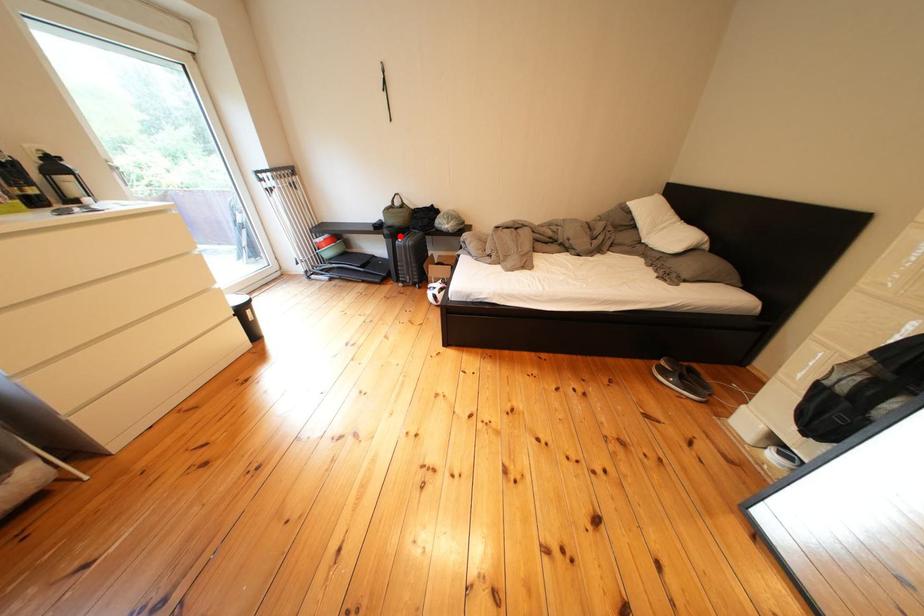
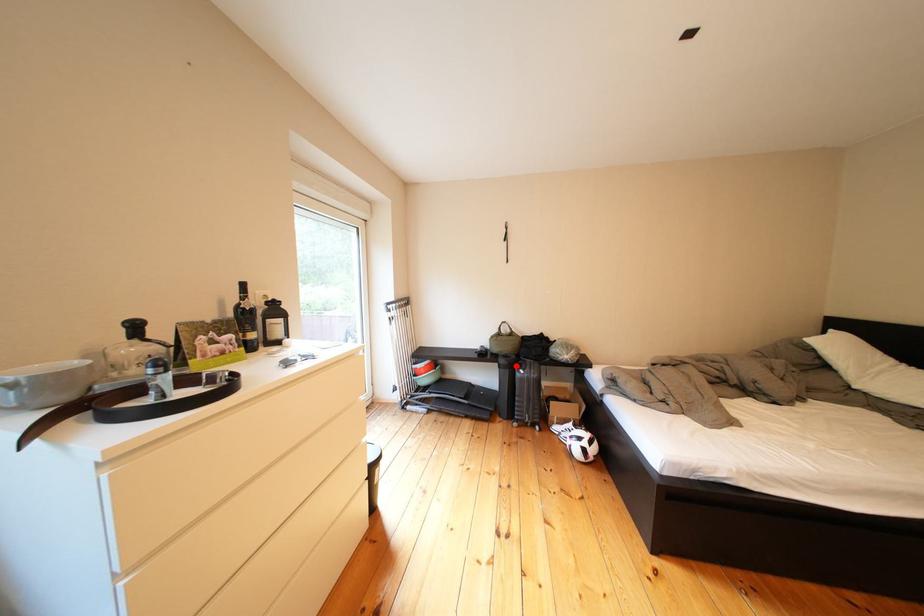
I am providing you with two images of the same scene from different viewpoints. A red point is marked on the first image and another point is marked on the second image. Are the points marked in image1 and image2 representing the same 3D position?

Yes